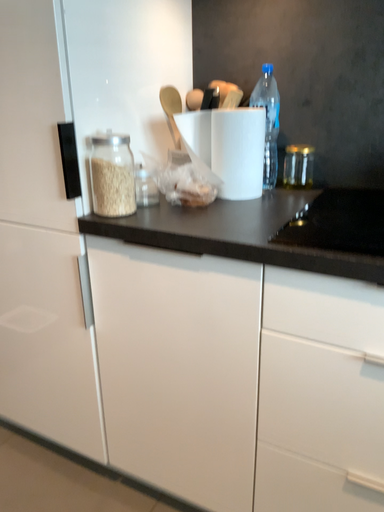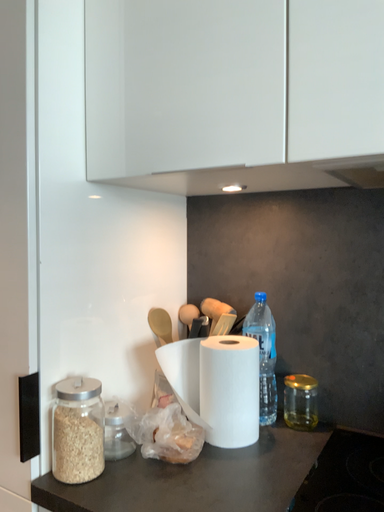
Question: Which way did the camera rotate in the video?

Choices:
 (A) rotated downward
 (B) rotated upward

Answer: (B)